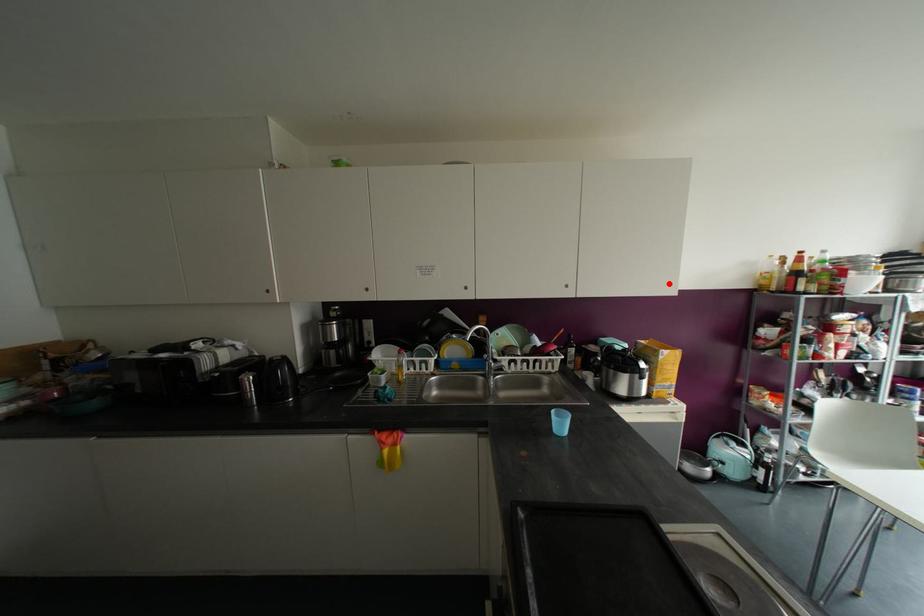
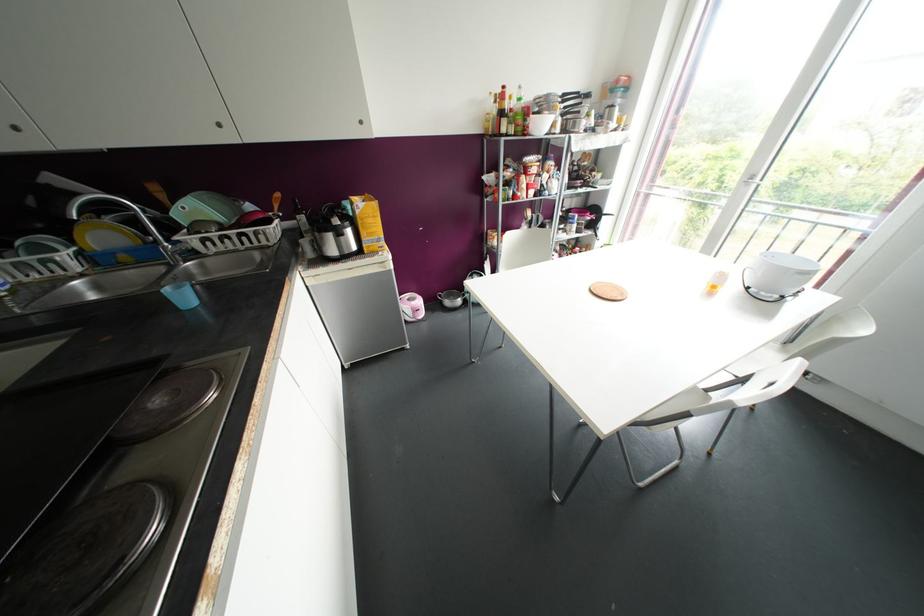
Where in the second image is the point corresponding to the highlighted location from the first image?

(360, 122)